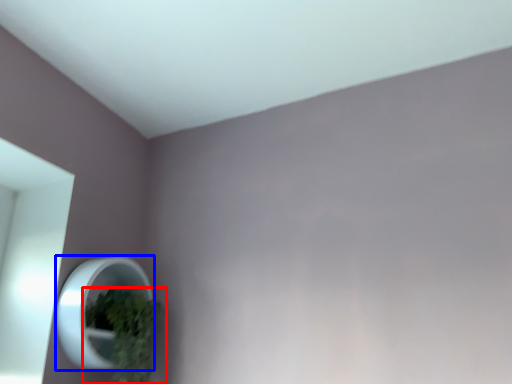
Question: Which object appears farthest to the camera in this image, houseplant (highlighted by a red box) or mirror (highlighted by a blue box)?

Choices:
 (A) houseplant
 (B) mirror

Answer: (A)